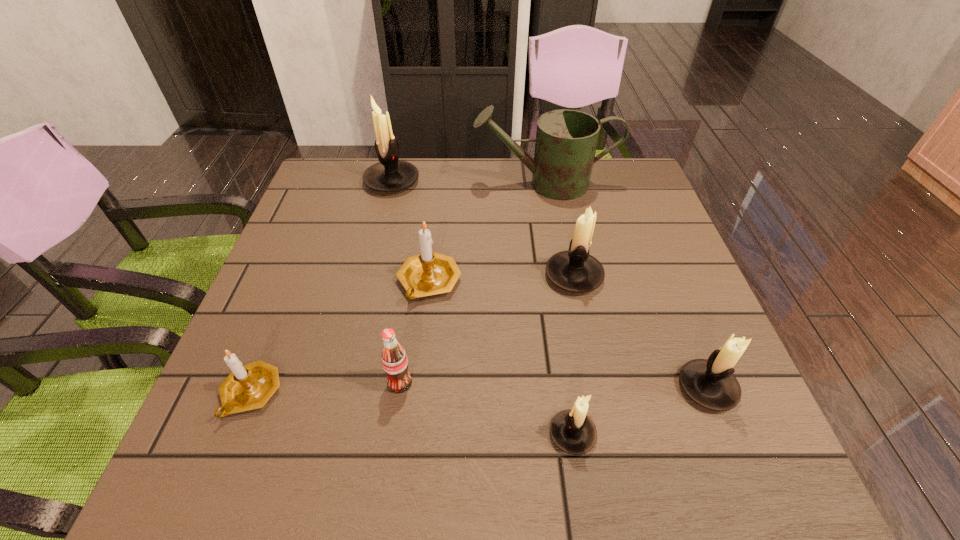
I want to click on the leftmost object, so click(x=250, y=386).

The height and width of the screenshot is (540, 960). Find the location of `the leftmost candle holder`. the leftmost candle holder is located at coordinates (250, 386).

You are a GUI agent. You are given a task and a screenshot of the screen. Output one action in this format:
    pyautogui.click(x=<x>, y=<y>)
    Task: Click on the smallest white candle holder
    The width and height of the screenshot is (960, 540).
    Given the screenshot: What is the action you would take?
    [572, 431]

Find the location of `vacant space located 0.090m on the front of the tallest candle holder`. vacant space located 0.090m on the front of the tallest candle holder is located at coordinates (383, 218).

Find the location of a particular element. The image size is (960, 540). vacant space located with the spout on the watering can is located at coordinates (407, 184).

Find the location of `blank space located 0.060m with the spout on the watering can`. blank space located 0.060m with the spout on the watering can is located at coordinates (453, 184).

The width and height of the screenshot is (960, 540). Identify the location of vacant space located 0.180m with the spout on the watering can. (411, 184).

The height and width of the screenshot is (540, 960). I want to click on vacant area situated 0.050m on the right of the second tallest candle holder, so click(x=625, y=276).

Where is `free space located 0.120m on the left of the right gold candle holder`? This screenshot has height=540, width=960. free space located 0.120m on the left of the right gold candle holder is located at coordinates (343, 282).

Identify the location of free spot located 0.250m on the left of the rightmost candle holder. This screenshot has width=960, height=540. (541, 388).